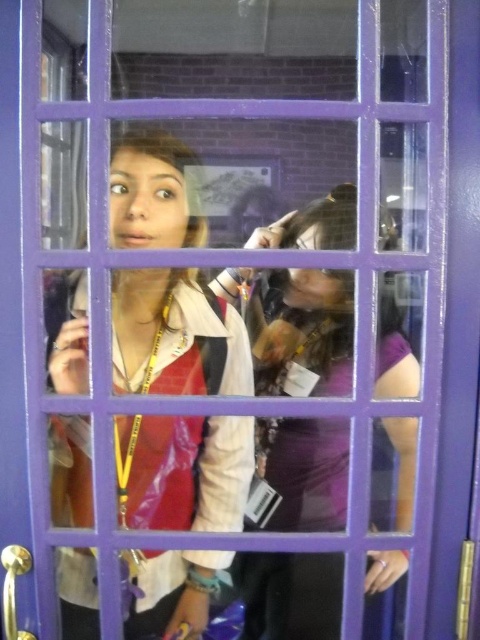
You are standing in front of a purple framed window with a grid pattern. You see a matte white shirt at center and a purple matte dress at center through the window. Which clothing item is closer to you?

The matte white shirt at center is closer to you because the purple matte dress at center is behind it.

You are designing a new clothing display window and need to arrange two items from the image. The matte white shirt at center and the purple matte dress at center must be placed side by side. Which item should be placed on the left to ensure they fit within the display window that is 1.2 meters wide?

The matte white shirt at center has a smaller width than the purple matte dress at center. To fit them side by side within the 1.2 meters display window, place the narrower matte white shirt at center on the left and the wider purple matte dress at center on the right.